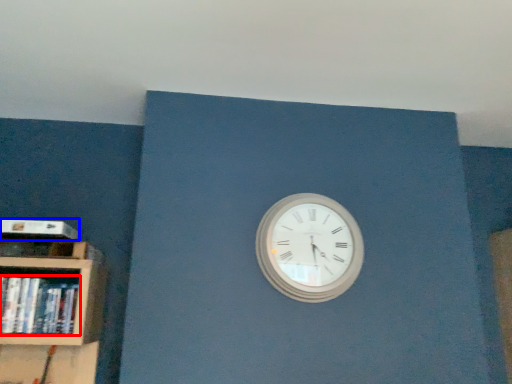
Question: Among these objects, which one is nearest to the camera, book (highlighted by a red box) or paperback book (highlighted by a blue box)?

Choices:
 (A) book
 (B) paperback book

Answer: (A)